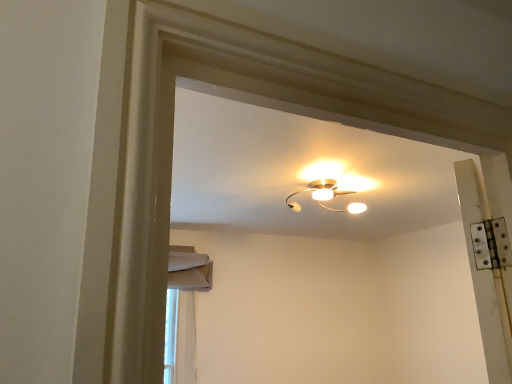
Locate an element on the screen. This screenshot has width=512, height=384. matte gold chandelier at upper center is located at coordinates pos(331,186).

What do you see at coordinates (331, 186) in the screenshot? I see `matte gold chandelier at upper center` at bounding box center [331, 186].

Locate an element on the screen. matte gold chandelier at upper center is located at coordinates (331, 186).